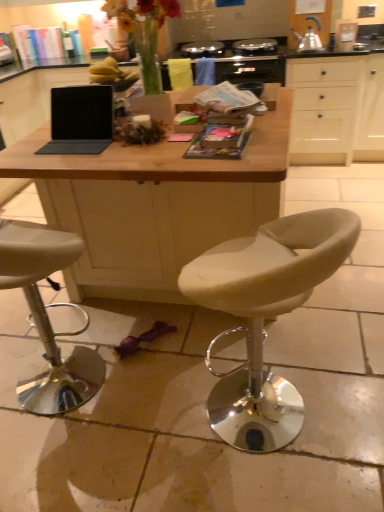
Locate an element on the screen. The image size is (384, 512). vacant space in front of matte paper magazine at center, which appears as the 2th magazine when viewed from the back is located at coordinates (225, 169).